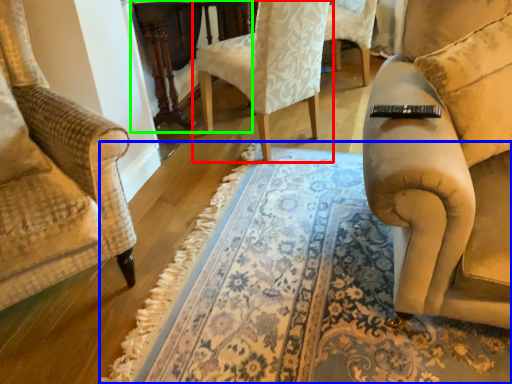
Question: Based on their relative distances, which object is farther from chair (highlighted by a red box)? Choose from mat (highlighted by a blue box) and round table (highlighted by a green box).

Choices:
 (A) mat
 (B) round table

Answer: (A)